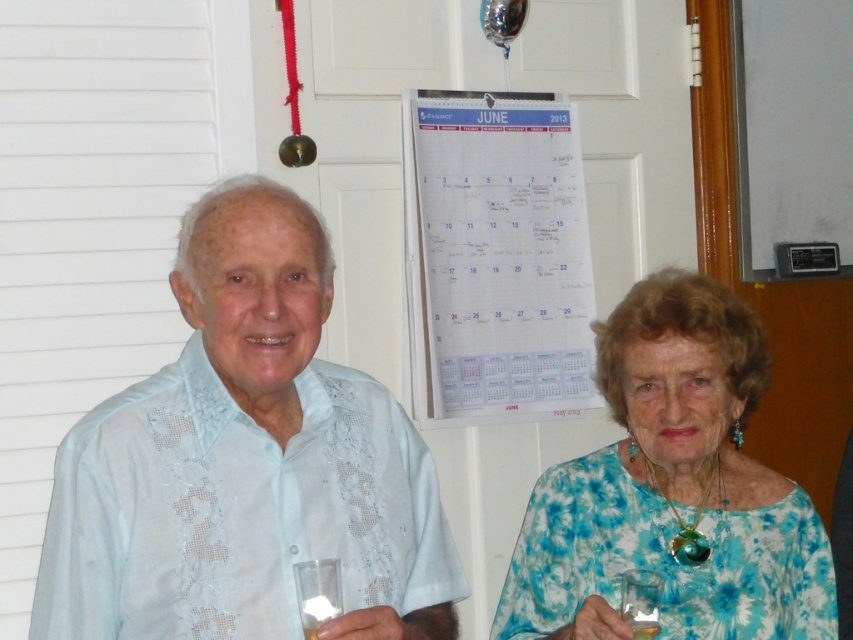
Between point (316, 614) and point (646, 637), which one is positioned in front?

Point (316, 614) is in front.

Which is above, clear glass at lower center or translucent glass at lower center?

clear glass at lower center

You are a GUI agent. You are given a task and a screenshot of the screen. Output one action in this format:
    pyautogui.click(x=<x>, y=<y>)
    Task: Click on the clear glass at lower center
    This screenshot has height=640, width=853.
    Given the screenshot: What is the action you would take?
    pyautogui.click(x=317, y=593)

The image size is (853, 640). I want to click on clear glass at lower center, so click(x=317, y=593).

Does blue floral dress at center have a lesser width compared to clear plastic wine glass at lower center?

Incorrect, blue floral dress at center's width is not less than clear plastic wine glass at lower center's.

Who is higher up, blue floral dress at center or clear plastic wine glass at lower center?

blue floral dress at center

Is point (608, 618) positioned in front of point (648, 602)?

That is True.

Find the location of a particular element. The width and height of the screenshot is (853, 640). blue floral dress at center is located at coordinates (672, 490).

Is the position of light blue fabric shirt at center less distant than that of clear plastic wine glass at lower center?

Yes, it is.

Does point (315, 289) lie in front of point (648, 595)?

Yes, point (315, 289) is closer to viewer.

Does point (206, 227) lie behind point (634, 580)?

No, (206, 227) is closer to viewer.

The width and height of the screenshot is (853, 640). I want to click on light blue fabric shirt at center, so click(247, 461).